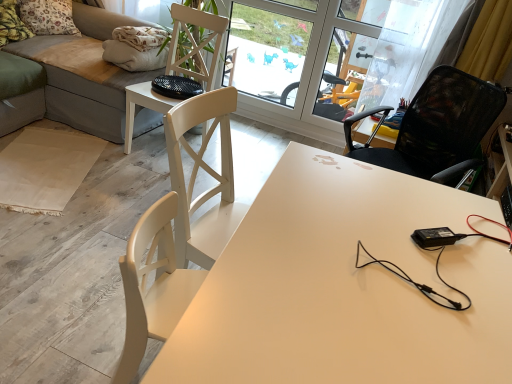
Question: From a real-world perspective, is white matte desk at center physically located above or below fluffy fabric pillow at upper left, positioned as the first pillow in front-to-back order?

Choices:
 (A) below
 (B) above

Answer: (A)

Question: Visually, is white matte desk at center positioned to the left or to the right of fluffy fabric pillow at upper left, positioned as the first pillow in front-to-back order?

Choices:
 (A) right
 (B) left

Answer: (A)

Question: Which object is positioned farthest from the fluffy fabric pillow at upper left, the 2th pillow from the back?

Choices:
 (A) white matte desk at center
 (B) transparent glass screen door at upper center
 (C) velvet grey couch at upper left
 (D) black mesh chair at upper right, arranged as the 2th chair when viewed from the left
 (E) white wood chair at center, which is the first chair in left-to-right order

Answer: (A)

Question: Which of these objects is positioned farthest from the transparent glass window at center?

Choices:
 (A) fluffy fabric pillow at upper left, the 2th pillow from the back
 (B) white wood chair at center, which is the first chair in left-to-right order
 (C) floral fabric pillow at upper left, which appears as the first pillow when viewed from the back
 (D) black mesh chair at upper right, arranged as the 2th chair when viewed from the left
 (E) white matte desk at center

Answer: (E)